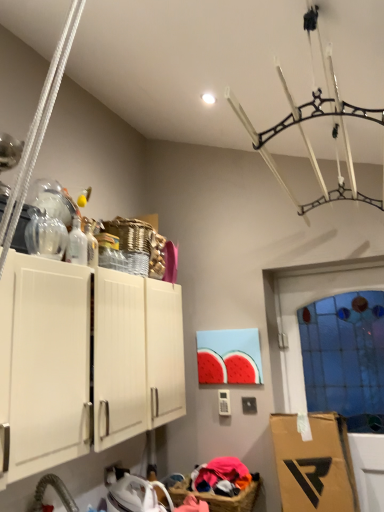
Question: Is transparent glass door at right wider than transparent glass bottle at upper left, the first bottle viewed from the front?

Choices:
 (A) yes
 (B) no

Answer: (B)

Question: Is transparent glass door at right positioned in front of transparent glass bottle at upper left, the first bottle viewed from the front?

Choices:
 (A) no
 (B) yes

Answer: (A)

Question: Does transparent glass door at right have a lesser width compared to transparent glass bottle at upper left, the first bottle viewed from the front?

Choices:
 (A) no
 (B) yes

Answer: (B)

Question: Is transparent glass door at right to the left of transparent glass bottle at upper left, placed as the 2th bottle when sorted from back to front, from the viewer's perspective?

Choices:
 (A) no
 (B) yes

Answer: (A)

Question: From a real-world perspective, does transparent glass door at right sit lower than transparent glass bottle at upper left, the first bottle viewed from the front?

Choices:
 (A) yes
 (B) no

Answer: (A)

Question: From a real-world perspective, relative to transparent glass bottle at upper left, placed as the 2th bottle when sorted from back to front, is brown wicker basket at lower center vertically above or below?

Choices:
 (A) below
 (B) above

Answer: (A)

Question: Relative to transparent glass bottle at upper left, the first bottle viewed from the front, is brown wicker basket at lower center in front or behind?

Choices:
 (A) front
 (B) behind

Answer: (B)

Question: Considering the positions of brown wicker basket at lower center and transparent glass bottle at upper left, placed as the 2th bottle when sorted from back to front, in the image, is brown wicker basket at lower center bigger or smaller than transparent glass bottle at upper left, placed as the 2th bottle when sorted from back to front,?

Choices:
 (A) small
 (B) big

Answer: (B)

Question: Do you think brown wicker basket at lower center is within transparent glass bottle at upper left, placed as the 2th bottle when sorted from back to front, or outside of it?

Choices:
 (A) outside
 (B) inside

Answer: (A)

Question: Considering the positions of white matte cabinet at upper left and transparent glass door at right in the image, is white matte cabinet at upper left wider or thinner than transparent glass door at right?

Choices:
 (A) wide
 (B) thin

Answer: (A)

Question: Considering their positions, is white matte cabinet at upper left located in front of or behind transparent glass door at right?

Choices:
 (A) behind
 (B) front

Answer: (B)

Question: Does point (19, 266) appear closer or farther from the camera than point (357, 368)?

Choices:
 (A) closer
 (B) farther

Answer: (A)

Question: In terms of height, does white matte cabinet at upper left look taller or shorter compared to transparent glass door at right?

Choices:
 (A) tall
 (B) short

Answer: (B)

Question: From a real-world perspective, is transparent glass bottle at upper left, placed as the 2th bottle when sorted from back to front, positioned above or below transparent glass door at right?

Choices:
 (A) above
 (B) below

Answer: (A)

Question: Considering the positions of transparent glass bottle at upper left, placed as the 2th bottle when sorted from back to front, and transparent glass door at right in the image, is transparent glass bottle at upper left, placed as the 2th bottle when sorted from back to front, bigger or smaller than transparent glass door at right?

Choices:
 (A) small
 (B) big

Answer: (A)